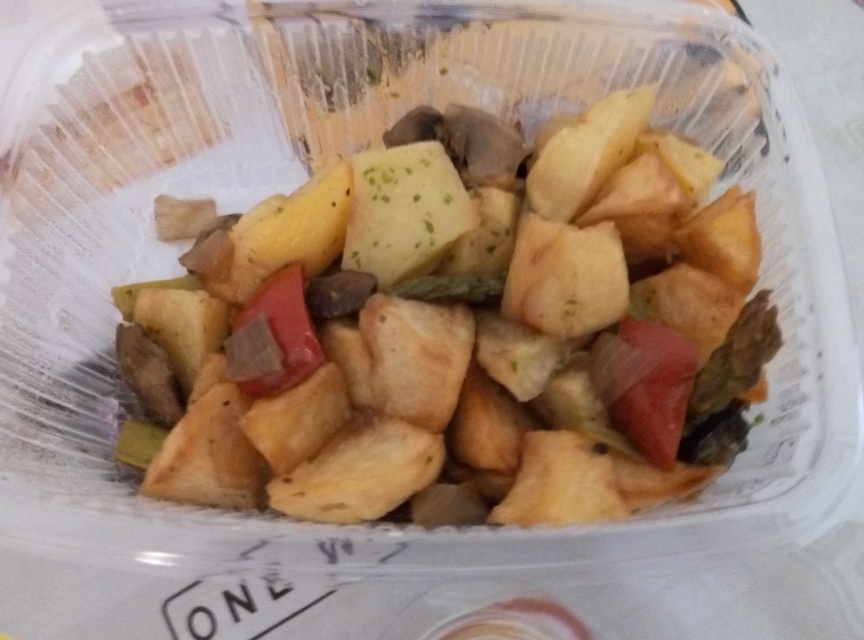
You are holding a clear plastic takeout container with a roasted vegetable dish. There are two points marked on the container at coordinates point (x=607, y=394) and point (x=226, y=339). If you want to place a sticker on the part of the container that is closer to you, which point should you choose?

Point (x=607, y=394) is closer to the viewer than point (x=226, y=339), so you should choose point (x=607, y=394) to place the sticker.

You are a food critic evaluating the arrangement of the dish in the takeout container. The dish contains a red matte tomato at center and a matte brown pepper at center. Which of these two items is taller?

The red matte tomato at center is taller than the matte brown pepper at center, so the red matte tomato at center is the taller item.

You are a food delivery person who needs to place a red matte tomato at center and a matte brown pepper at center into a clear plastic container. Based on the scene description, where should you place each item relative to the other?

The red matte tomato at center should be placed below the matte brown pepper at center in the container.